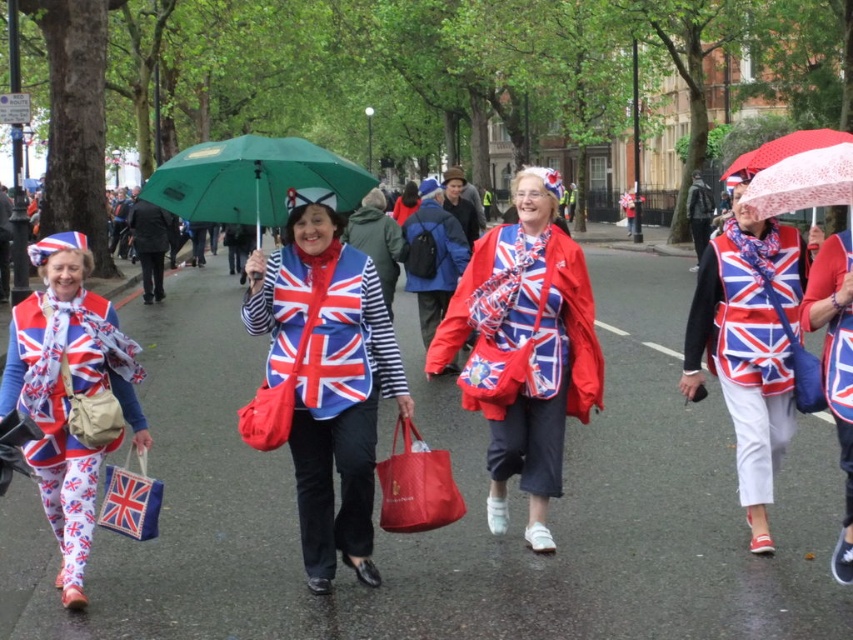
Question: Does matte red jacket at center appear on the right side of matte red fabric shopping bag at center?

Choices:
 (A) yes
 (B) no

Answer: (A)

Question: Among these points, which one is farthest from the camera?

Choices:
 (A) (352, 429)
 (B) (505, 342)
 (C) (390, 490)
 (D) (784, 429)

Answer: (D)

Question: Which of these objects is positioned farthest from the red lace umbrella at upper right?

Choices:
 (A) matte fabric bag at center
 (B) green fabric umbrella at center

Answer: (B)

Question: Is matte fabric jacket at center bigger than green fabric umbrella at center?

Choices:
 (A) yes
 (B) no

Answer: (B)

Question: Which point is closer to the camera taking this photo?

Choices:
 (A) (808, 145)
 (B) (223, 176)
 (C) (531, 426)

Answer: (A)

Question: Is matte fabric jacket at center smaller than matte fabric bag at center?

Choices:
 (A) yes
 (B) no

Answer: (B)